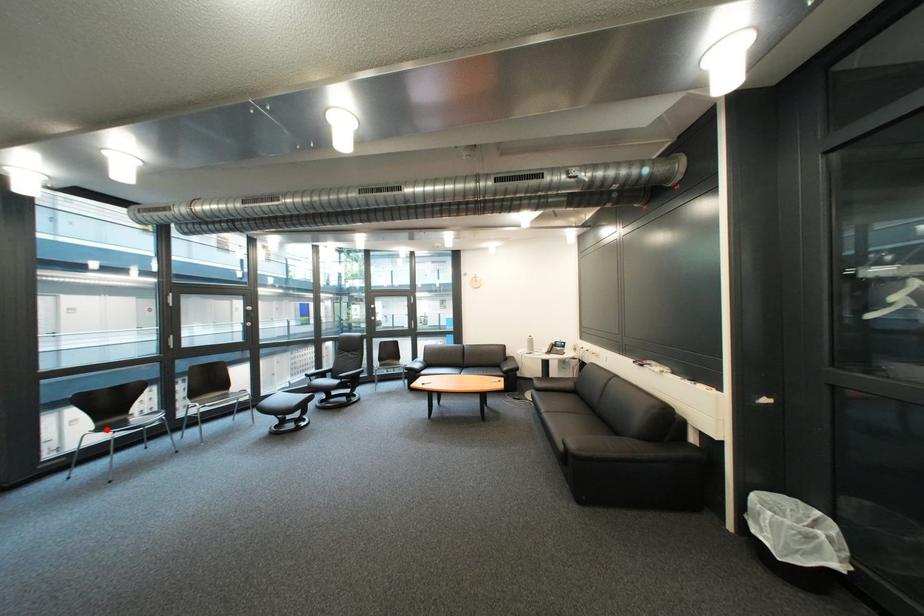
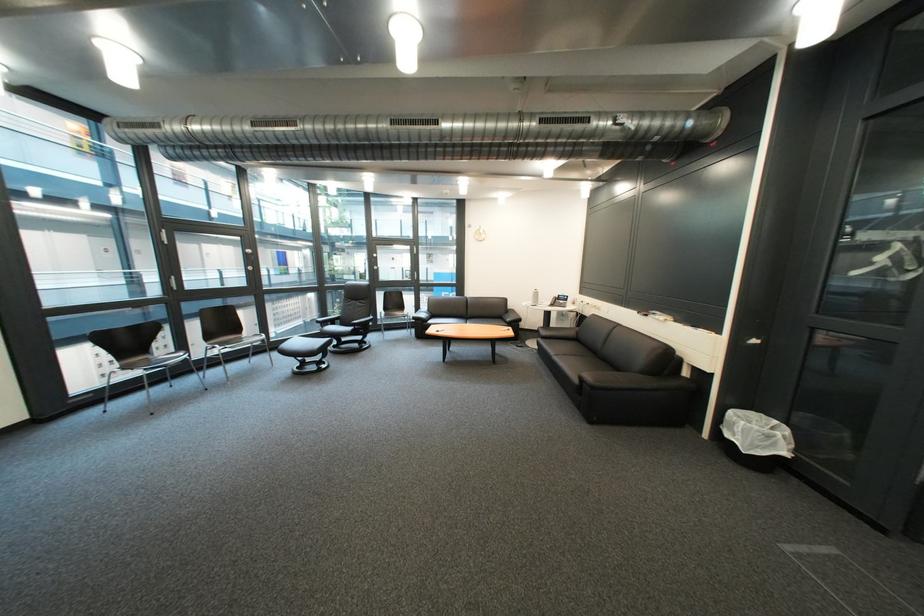
Question: A red point is marked in image1. In image2, is the corresponding 3D point closer to the camera or farther? Reply with the corresponding letter.

Choices:
 (A) The corresponding 3D point is closer.
 (B) The corresponding 3D point is farther.

Answer: (B)